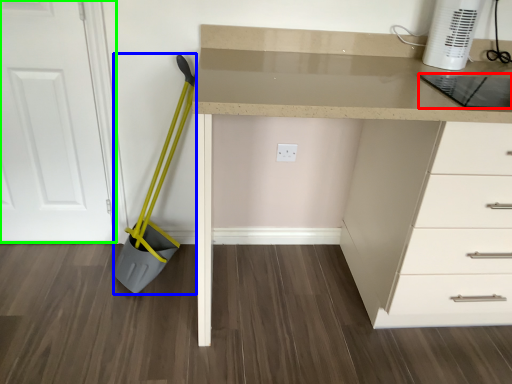
Question: Which is farther away from kitchen appliance (highlighted by a red box)? shovel (highlighted by a blue box) or door (highlighted by a green box)?

Choices:
 (A) shovel
 (B) door

Answer: (B)